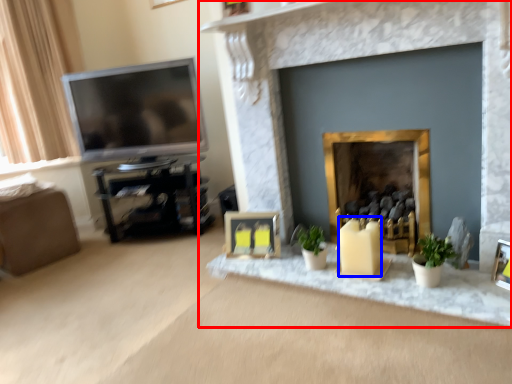
Question: Which of the following is the farthest to the observer, fireplace (highlighted by a red box) or candle (highlighted by a blue box)?

Choices:
 (A) fireplace
 (B) candle

Answer: (B)